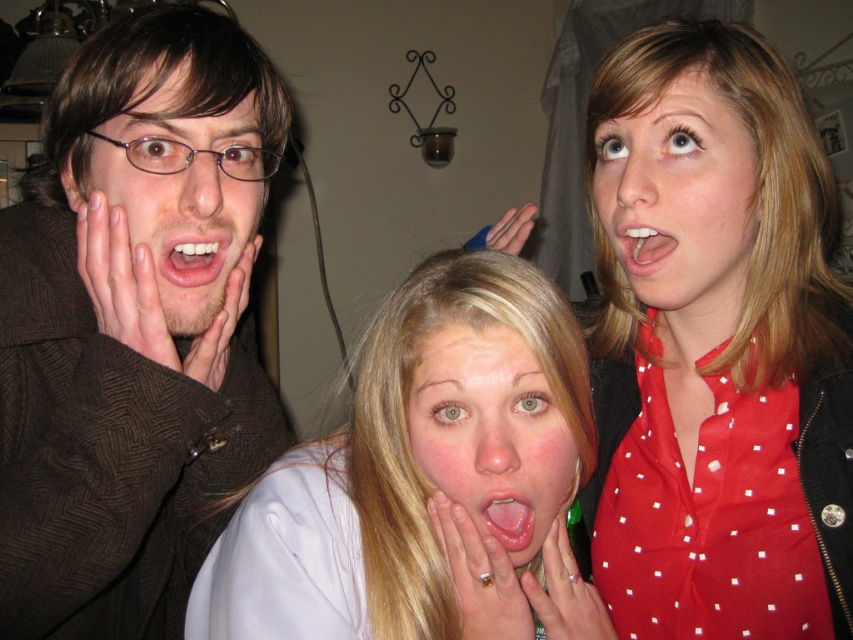
Can you confirm if matte brown hair at center is bigger than pale skin face at center?

Yes.

Is matte brown hair at center smaller than pale skin face at center?

No.

This screenshot has width=853, height=640. Find the location of `matte brown hair at center`. matte brown hair at center is located at coordinates (164, 244).

Does pale skin face at center have a lesser height compared to pink glossy tongue at center?

Incorrect, pale skin face at center's height does not fall short of pink glossy tongue at center's.

Between pale skin face at center and pink glossy tongue at center, which one appears on the right side from the viewer's perspective?

Positioned to the right is pink glossy tongue at center.

Does point (503, 456) come behind point (496, 528)?

No, it is not.

At what (x,y) coordinates should I click in order to perform the action: click on pale skin face at center. Please return your answer as a coordinate pair (x, y). The image size is (853, 640). Looking at the image, I should click on (490, 435).

Is smooth red blouse at upper right below smooth white teeth at center?

No, smooth red blouse at upper right is not below smooth white teeth at center.

Who is more distant from viewer, (653, 140) or (621, 257)?

The point (621, 257) is more distant.

Is point (743, 184) farther from camera compared to point (654, 240)?

No, (743, 184) is closer to viewer.

Locate an element on the screen. Image resolution: width=853 pixels, height=640 pixels. smooth red blouse at upper right is located at coordinates (679, 202).